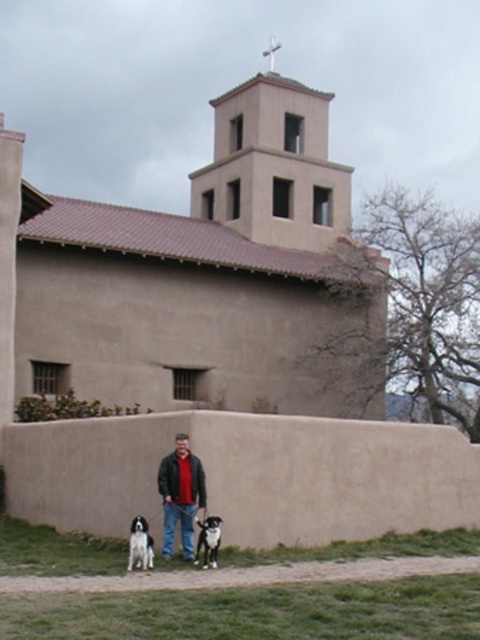
Question: Which of these objects is positioned closest to the black and white fur at lower center?

Choices:
 (A) white fur dog at lower left
 (B) dark gray jacket at center

Answer: (B)

Question: Among these points, which one is nearest to the camera?

Choices:
 (A) (200, 531)
 (B) (170, 536)

Answer: (A)

Question: Does dark gray jacket at center lie behind black and white fur at lower center?

Choices:
 (A) yes
 (B) no

Answer: (A)

Question: Which point appears farthest from the camera in this image?

Choices:
 (A) (216, 532)
 (B) (131, 538)

Answer: (B)

Question: Is dark gray jacket at center positioned behind black and white fur at lower center?

Choices:
 (A) yes
 (B) no

Answer: (A)

Question: Does dark gray jacket at center appear on the left side of black and white fur at lower center?

Choices:
 (A) no
 (B) yes

Answer: (B)